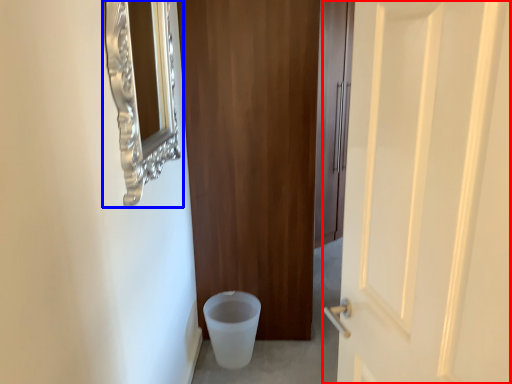
Question: Which point is further to the camera, door (highlighted by a red box) or medicine cabinet (highlighted by a blue box)?

Choices:
 (A) door
 (B) medicine cabinet

Answer: (B)